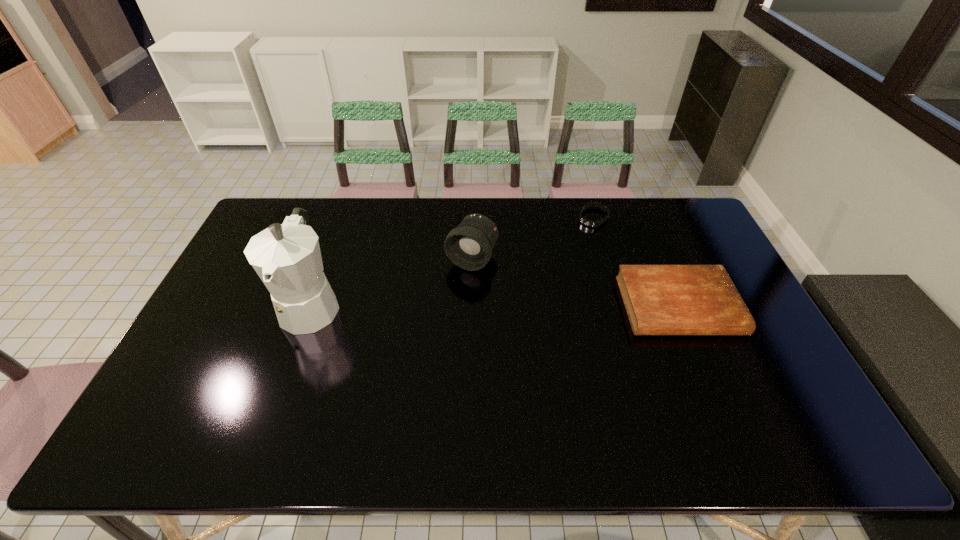
Identify the location of free region at the right edge. (732, 368).

The height and width of the screenshot is (540, 960). Find the location of `vacant space at the far left corner of the desktop`. vacant space at the far left corner of the desktop is located at coordinates (269, 215).

Locate an element on the screen. free region at the near right corner of the desktop is located at coordinates (791, 391).

This screenshot has width=960, height=540. Identify the location of vacant space that's between the leftmost object and the Bible. (494, 305).

Where is `vacant space in between the Bible and the third object from right to left`? The width and height of the screenshot is (960, 540). vacant space in between the Bible and the third object from right to left is located at coordinates [575, 282].

Locate an element on the screen. This screenshot has height=540, width=960. unoccupied position between the second shortest object and the coffeepot is located at coordinates point(494,305).

Image resolution: width=960 pixels, height=540 pixels. I want to click on vacant space in between the second object from left to right and the wristband, so click(x=533, y=238).

Where is `empty location between the third tallest object and the farthest object`? This screenshot has width=960, height=540. empty location between the third tallest object and the farthest object is located at coordinates (636, 262).

Find the location of `vacant region between the telephoto lens and the farthest object`. vacant region between the telephoto lens and the farthest object is located at coordinates (533, 238).

Locate an element on the screen. free spot between the leftmost object and the second tallest object is located at coordinates (392, 281).